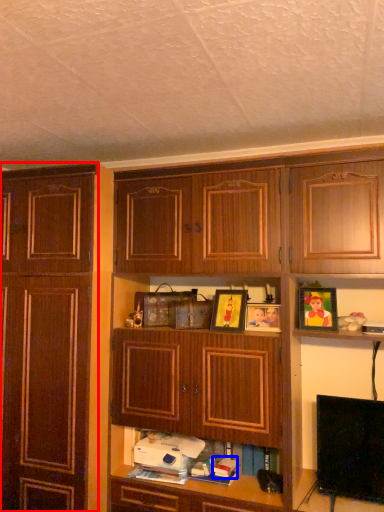
Question: Which object appears closest to the camera in this image, cabinetry (highlighted by a red box) or book (highlighted by a blue box)?

Choices:
 (A) cabinetry
 (B) book

Answer: (A)